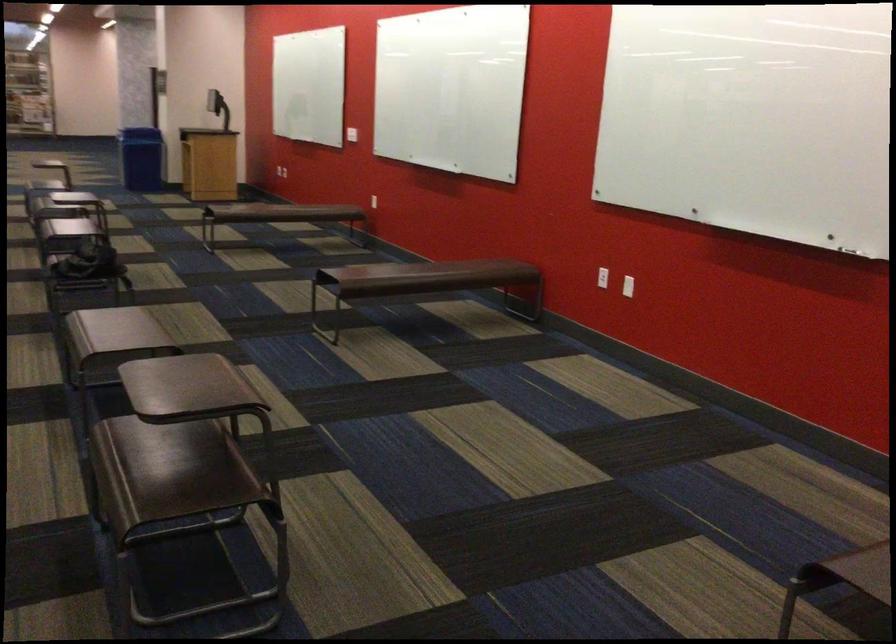
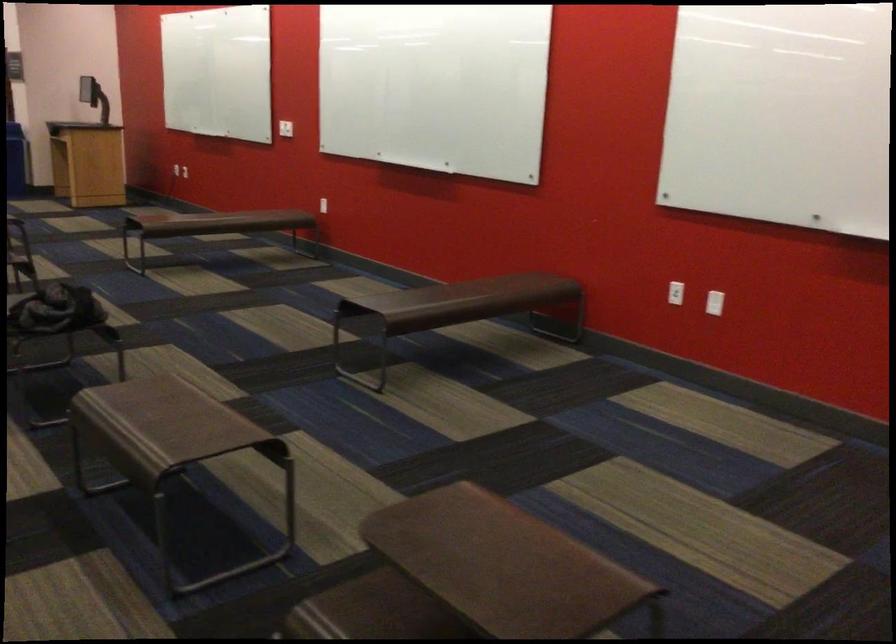
Where in the second image is the point corresponding to point (600, 277) from the first image?

(675, 292)